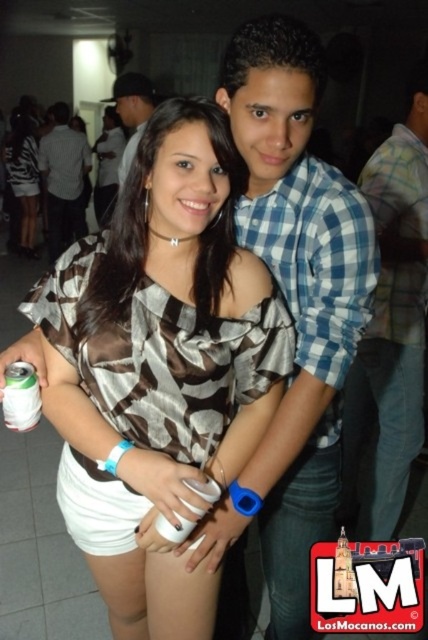
Question: Does matte black dress at center have a smaller size compared to green matte can at lower left?

Choices:
 (A) yes
 (B) no

Answer: (B)

Question: Which of the following is the closest to the observer?

Choices:
 (A) matte black shirt at center
 (B) matte black cap at upper left

Answer: (B)

Question: Is matte black shirt at center positioned before green matte can at lower left?

Choices:
 (A) no
 (B) yes

Answer: (A)

Question: Which object is positioned closest to the brown satin blouse at center?

Choices:
 (A) matte black shirt at center
 (B) blue checkered shirt at center
 (C) matte black dress at center
 (D) green matte can at lower left

Answer: (B)

Question: Which object appears closest to the camera in this image?

Choices:
 (A) blue plaid shirt at center
 (B) green matte can at lower left

Answer: (B)

Question: Is blue checkered shirt at center wider than matte black shirt at center?

Choices:
 (A) yes
 (B) no

Answer: (B)